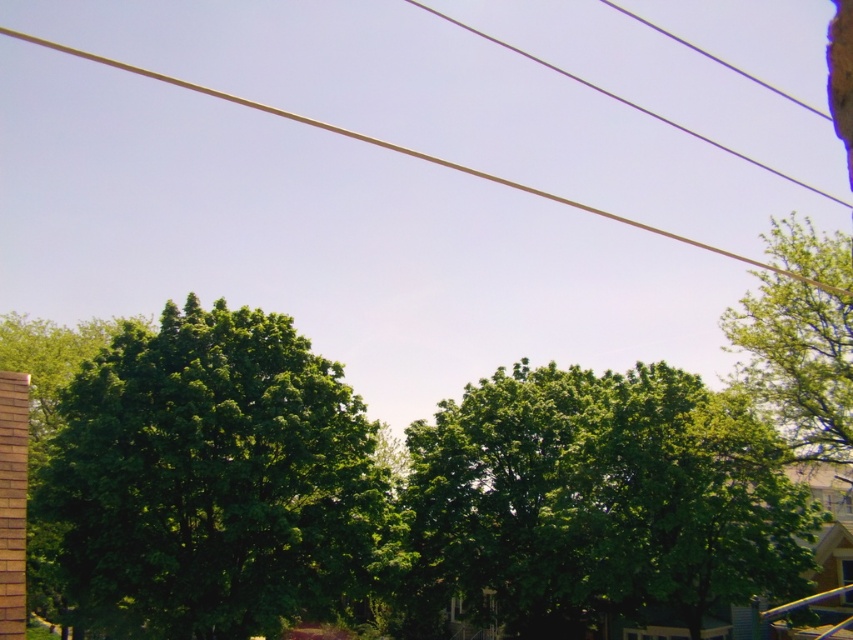
You are standing at point (213, 477) in the image. Looking around, you see a green leafy tree at left. Which direction should you walk to get closer to the green leafy tree at left?

Since you are already at the point where the green leafy tree at left is located, you are already at the location of the green leafy tree at left.

You are standing in the middle of the scene and want to take a photo of both the green leafy tree at left and the green leafy tree at upper right. Which tree should you focus on first to ensure both are in sharp focus?

You should focus on the green leafy tree at left first because it is closer to you than the green leafy tree at upper right, which is further away. By focusing on the closer tree, the farther one will also be in focus due to the depth of field.

You are a gardener assessing the trees in the scene. You notice the green leafy tree at left and the green leafy tree at center. Which tree requires more space for its root system based on their sizes?

The green leafy tree at center requires more space for its root system since it is larger than the green leafy tree at left.